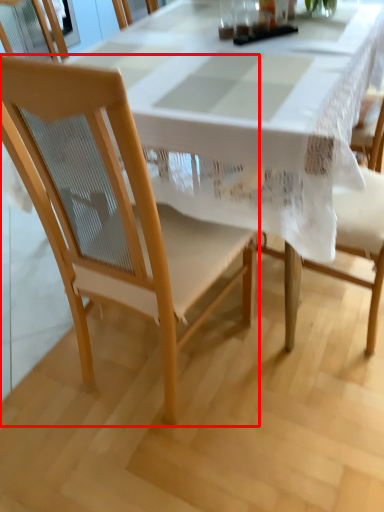
Question: Considering the relative positions of chair (annotated by the red box) and tablecloth in the image provided, where is chair (annotated by the red box) located with respect to the staircase?

Choices:
 (A) left
 (B) right

Answer: (A)